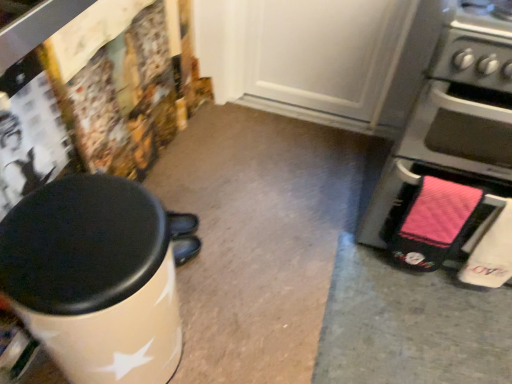
Question: Are white glossy waste container at left and pink fabric oven at right far apart?

Choices:
 (A) yes
 (B) no

Answer: (B)

Question: Considering the relative positions of white glossy waste container at left and pink fabric oven at right in the image provided, is white glossy waste container at left to the left of pink fabric oven at right from the viewer's perspective?

Choices:
 (A) yes
 (B) no

Answer: (A)

Question: From a real-world perspective, is white glossy waste container at left located higher than pink fabric oven at right?

Choices:
 (A) yes
 (B) no

Answer: (B)

Question: Can you confirm if white glossy waste container at left is wider than pink fabric oven at right?

Choices:
 (A) no
 (B) yes

Answer: (A)

Question: Considering the relative positions of white glossy waste container at left and pink fabric oven at right in the image provided, is white glossy waste container at left in front of pink fabric oven at right?

Choices:
 (A) no
 (B) yes

Answer: (B)

Question: Can you confirm if white glossy waste container at left is smaller than pink fabric oven at right?

Choices:
 (A) no
 (B) yes

Answer: (B)

Question: Does pink fabric oven at right have a lesser width compared to white glossy waste container at left?

Choices:
 (A) yes
 (B) no

Answer: (B)

Question: From a real-world perspective, is pink fabric oven at right positioned under white glossy waste container at left based on gravity?

Choices:
 (A) no
 (B) yes

Answer: (A)

Question: From the image's perspective, is pink fabric oven at right below white glossy waste container at left?

Choices:
 (A) yes
 (B) no

Answer: (B)

Question: Does pink fabric oven at right turn towards white glossy waste container at left?

Choices:
 (A) no
 (B) yes

Answer: (A)

Question: From the image's perspective, is pink fabric oven at right on white glossy waste container at left?

Choices:
 (A) no
 (B) yes

Answer: (B)

Question: Does pink fabric oven at right have a greater width compared to white glossy waste container at left?

Choices:
 (A) yes
 (B) no

Answer: (A)

Question: Considering the positions of pink fabric oven at right and white glossy waste container at left in the image, is pink fabric oven at right taller or shorter than white glossy waste container at left?

Choices:
 (A) short
 (B) tall

Answer: (B)